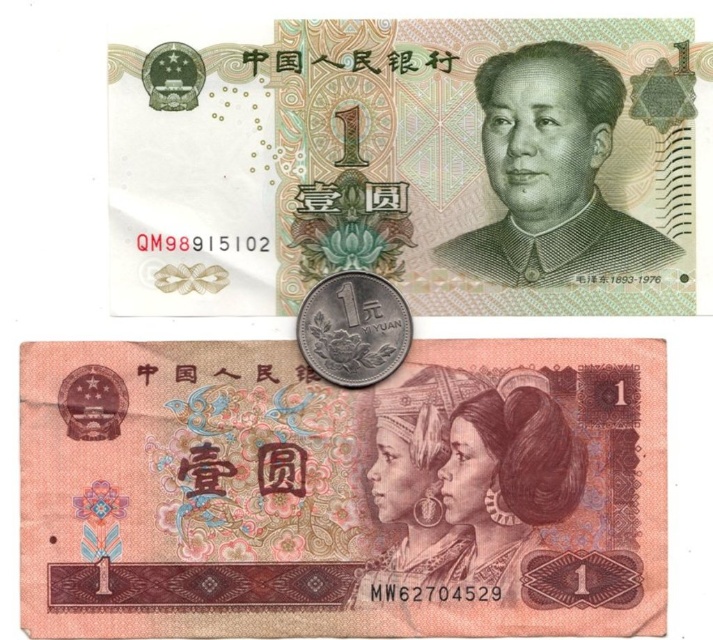
Question: Where is matte paper banknote at center located in relation to silver metallic coin at center in the image?

Choices:
 (A) left
 (B) right

Answer: (B)

Question: Does matte paper banknote at center have a smaller size compared to silver metallic coin at center?

Choices:
 (A) yes
 (B) no

Answer: (B)

Question: Which of these objects is positioned farthest from the silver metallic coin at center?

Choices:
 (A) smooth paper banknote at center
 (B) matte paper banknote at center

Answer: (A)

Question: Is matte paper banknote at center positioned at the back of silver metallic coin at center?

Choices:
 (A) yes
 (B) no

Answer: (B)

Question: Which point is closer to the camera?

Choices:
 (A) (245, 628)
 (B) (266, 180)

Answer: (A)

Question: Which object is the farthest from the silver metallic coin at center?

Choices:
 (A) smooth paper banknote at center
 (B) matte paper banknote at center

Answer: (A)